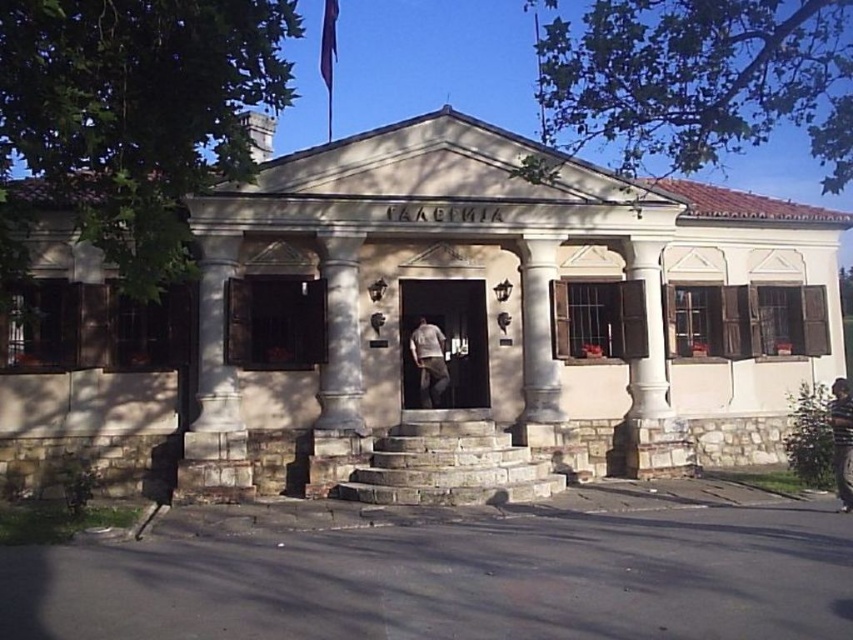
Looking at this image, you are standing in front of the classical building and want to take a photo. The camera you are using has a maximum focus range of 15 meters. Can the camera focus on the white marble column at center?

The white marble column at center is 13.73 meters away from the camera, which is within the maximum focus range of 15 meters. Therefore, the camera can focus on the white marble column at center.

You are an architect examining the classical building. You notice the white marble column at center and the brown leather jacket at lower right. Which object would require more space to move around it?

The white marble column at center is larger in size than the brown leather jacket at lower right, so it would require more space to move around it.

You are standing at the entrance of the classical building and notice two items at the center of the scene. Which one is closer to you between the white marble column at center and the white cotton shirt at center?

The white marble column at center is closer to you because it is in front of the white cotton shirt at center.